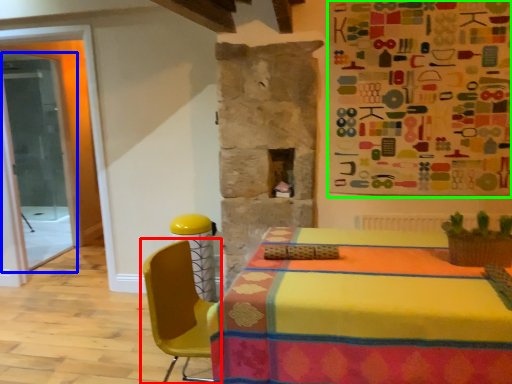
Question: Which object is the farthest from chair (highlighted by a red box)? Choose among these: glass door (highlighted by a blue box) or bulletin board (highlighted by a green box).

Choices:
 (A) glass door
 (B) bulletin board

Answer: (A)